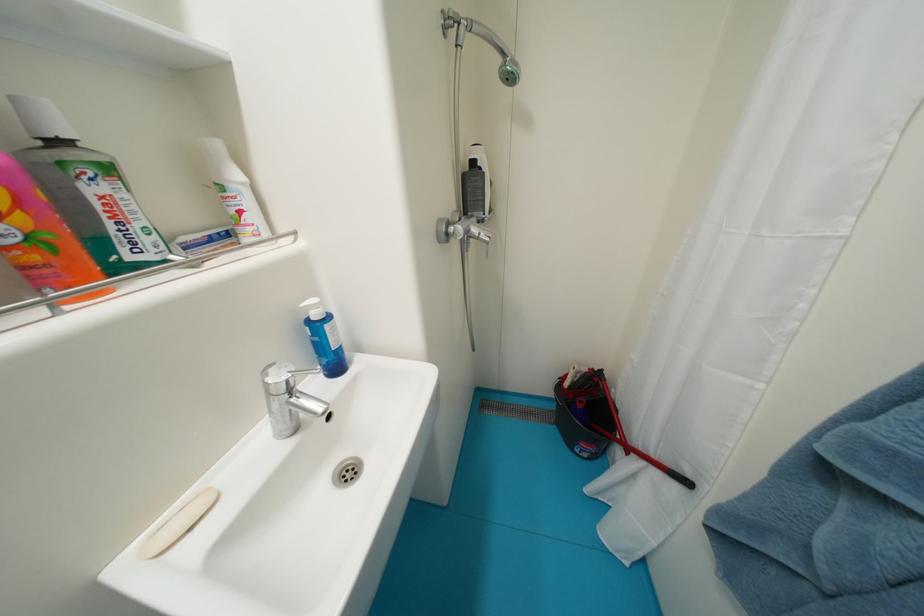
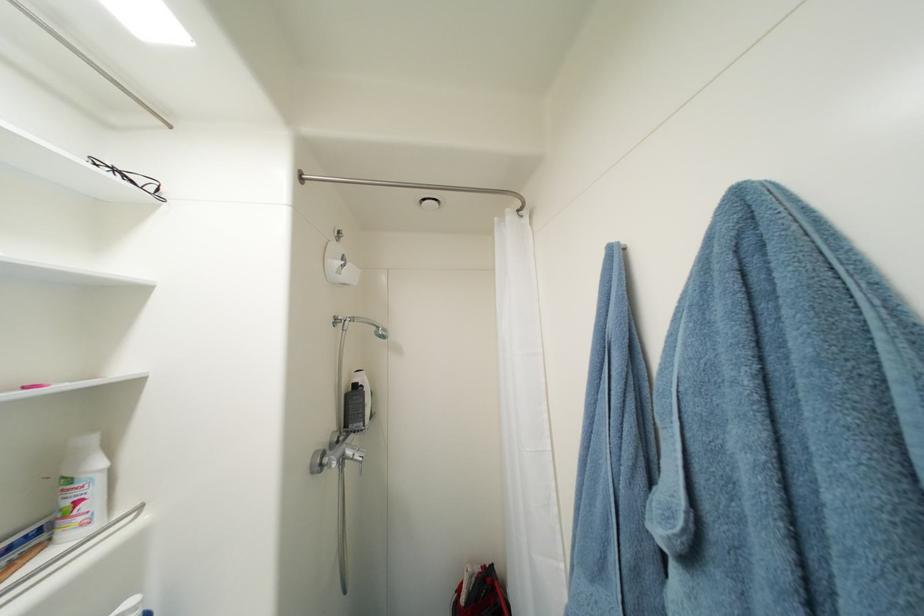
Locate, in the second image, the point that corresponds to pixel 480 164 in the first image.

(361, 387)